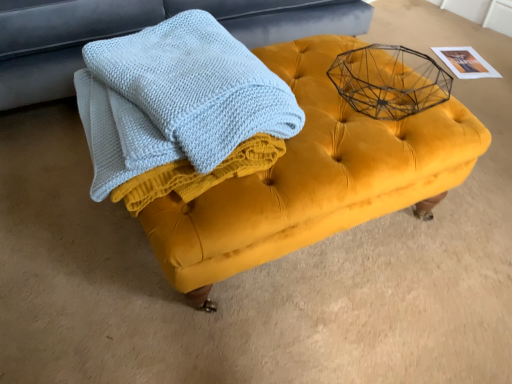
Question: Should I look upward or downward to see velvet yellow ottoman at center?

Choices:
 (A) up
 (B) down

Answer: (A)

Question: Does light blue knitted towel at center appear on the right side of velvet yellow ottoman at center?

Choices:
 (A) no
 (B) yes

Answer: (B)

Question: Is light blue knitted towel at center bigger than velvet yellow ottoman at center?

Choices:
 (A) no
 (B) yes

Answer: (A)

Question: Is light blue knitted towel at center beside velvet yellow ottoman at center?

Choices:
 (A) no
 (B) yes

Answer: (A)

Question: Considering the relative sizes of light blue knitted towel at center and velvet yellow ottoman at center in the image provided, is light blue knitted towel at center taller than velvet yellow ottoman at center?

Choices:
 (A) no
 (B) yes

Answer: (A)

Question: Is light blue knitted towel at center at the left side of velvet yellow ottoman at center?

Choices:
 (A) yes
 (B) no

Answer: (B)

Question: Is light blue knitted towel at center surrounding velvet yellow ottoman at center?

Choices:
 (A) yes
 (B) no

Answer: (B)

Question: From a real-world perspective, is light blue knitted towel at center on velvet yellow ottoman at center?

Choices:
 (A) yes
 (B) no

Answer: (A)

Question: Does light blue knitted towel at center come behind velvet yellow ottoman at center?

Choices:
 (A) no
 (B) yes

Answer: (A)

Question: Can you confirm if light blue knitted towel at center is taller than velvet yellow ottoman at center?

Choices:
 (A) no
 (B) yes

Answer: (A)

Question: Is light blue knitted towel at center outside of velvet yellow ottoman at center?

Choices:
 (A) no
 (B) yes

Answer: (B)

Question: From a real-world perspective, is light blue knitted towel at center physically below velvet yellow ottoman at center?

Choices:
 (A) yes
 (B) no

Answer: (B)

Question: Can you confirm if light blue knitted towel at center is shorter than velvet yellow ottoman at center?

Choices:
 (A) no
 (B) yes

Answer: (B)

Question: Can you confirm if velvet yellow ottoman at center is taller than light blue knitted towel at center?

Choices:
 (A) yes
 (B) no

Answer: (A)